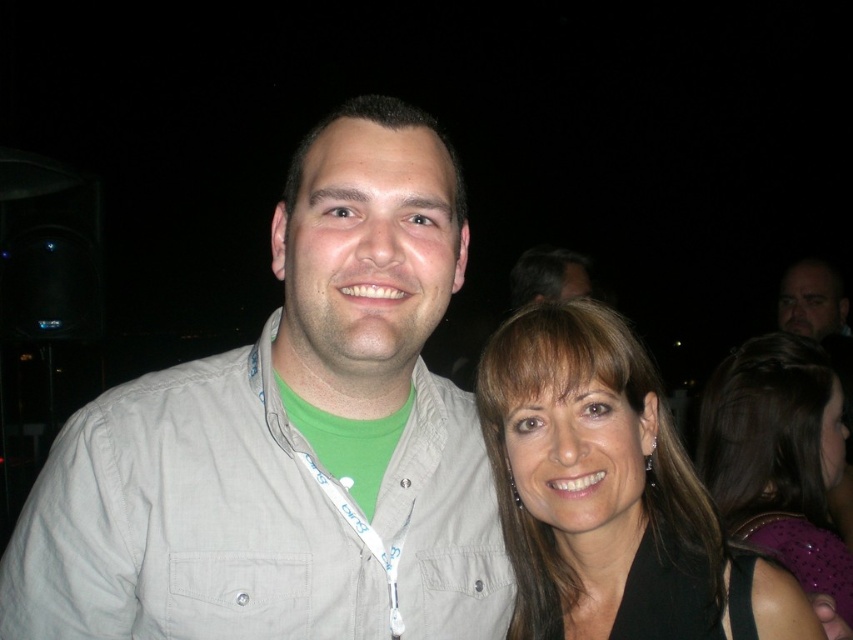
Is point (200, 557) farther from camera compared to point (836, 428)?

No, (200, 557) is in front of (836, 428).

How far apart are light gray shirt at center and black fabric hair at upper right?

light gray shirt at center is 28.10 inches away from black fabric hair at upper right.

Where is `light gray shirt at center`? The image size is (853, 640). light gray shirt at center is located at coordinates (289, 440).

Can you confirm if smooth brown hair at center is bigger than black fabric hair at upper right?

Incorrect, smooth brown hair at center is not larger than black fabric hair at upper right.

At what (x,y) coordinates should I click in order to perform the action: click on smooth brown hair at center. Please return your answer as a coordinate pair (x, y). Looking at the image, I should click on (611, 496).

You are a GUI agent. You are given a task and a screenshot of the screen. Output one action in this format:
    pyautogui.click(x=<x>, y=<y>)
    Task: Click on the smooth brown hair at center
    This screenshot has height=640, width=853.
    Given the screenshot: What is the action you would take?
    pyautogui.click(x=611, y=496)

Which is below, smooth brown hair at center or dark brown hair at upper center?

smooth brown hair at center is below.

Can you confirm if smooth brown hair at center is shorter than dark brown hair at upper center?

In fact, smooth brown hair at center may be taller than dark brown hair at upper center.

This screenshot has width=853, height=640. In order to click on smooth brown hair at center in this screenshot , I will do `click(611, 496)`.